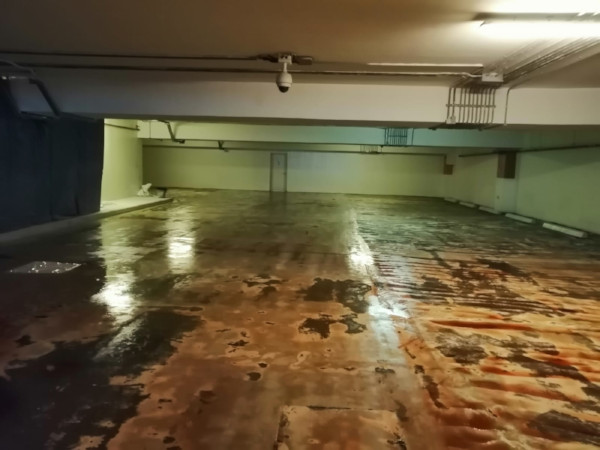
The width and height of the screenshot is (600, 450). I want to click on ceiling pillars, so click(x=325, y=95), click(x=327, y=127), click(x=328, y=147).